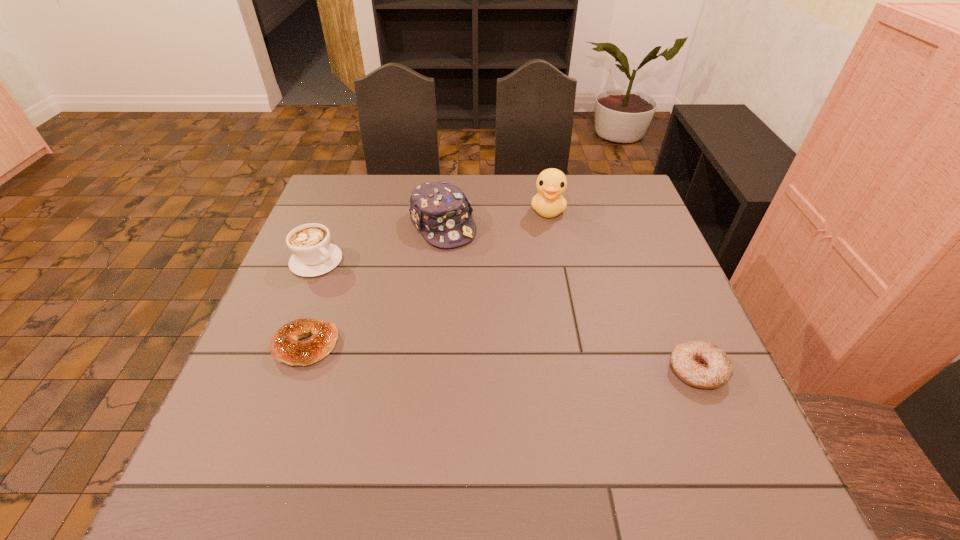
At what (x,y) coordinates should I click in order to perform the action: click on vacant space on the desktop that is between the bagel and the doughnut and is positioned to the right of the third shortest object's handle. Please return your answer as a coordinate pair (x, y). This screenshot has width=960, height=540. Looking at the image, I should click on (x=467, y=356).

This screenshot has width=960, height=540. Identify the location of free spot on the desktop that is between the shortest object and the doughnut and is positioned on the front-facing side of the second tallest object. (537, 361).

Image resolution: width=960 pixels, height=540 pixels. I want to click on vacant space on the desktop that is between the bagel and the rightmost object and is positioned on the face of the tallest object, so click(534, 361).